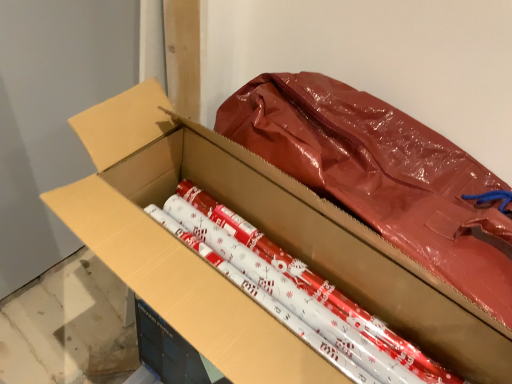
Question: Is matte cardboard box at center thinner than shiny metallic wrapping paper at center?

Choices:
 (A) no
 (B) yes

Answer: (B)

Question: Is matte cardboard box at center in contact with shiny metallic wrapping paper at center?

Choices:
 (A) no
 (B) yes

Answer: (A)

Question: Can you confirm if matte cardboard box at center is taller than shiny metallic wrapping paper at center?

Choices:
 (A) no
 (B) yes

Answer: (B)

Question: Can you confirm if matte cardboard box at center is shorter than shiny metallic wrapping paper at center?

Choices:
 (A) no
 (B) yes

Answer: (A)

Question: Does matte cardboard box at center have a smaller size compared to shiny metallic wrapping paper at center?

Choices:
 (A) yes
 (B) no

Answer: (B)

Question: Is the depth of matte cardboard box at center greater than that of shiny metallic wrapping paper at center?

Choices:
 (A) yes
 (B) no

Answer: (B)

Question: Can you confirm if shiny metallic wrapping paper at center is smaller than matte cardboard box at center?

Choices:
 (A) no
 (B) yes

Answer: (B)

Question: Is shiny metallic wrapping paper at center at the right side of matte cardboard box at center?

Choices:
 (A) yes
 (B) no

Answer: (A)

Question: Considering the relative sizes of shiny metallic wrapping paper at center and matte cardboard box at center in the image provided, is shiny metallic wrapping paper at center shorter than matte cardboard box at center?

Choices:
 (A) no
 (B) yes

Answer: (B)

Question: From a real-world perspective, is shiny metallic wrapping paper at center positioned under matte cardboard box at center based on gravity?

Choices:
 (A) yes
 (B) no

Answer: (A)

Question: Can you confirm if shiny metallic wrapping paper at center is bigger than matte cardboard box at center?

Choices:
 (A) no
 (B) yes

Answer: (A)

Question: Does shiny metallic wrapping paper at center have a greater height compared to matte cardboard box at center?

Choices:
 (A) yes
 (B) no

Answer: (B)

Question: Considering the positions of point (111, 236) and point (263, 279), is point (111, 236) closer or farther from the camera than point (263, 279)?

Choices:
 (A) closer
 (B) farther

Answer: (A)